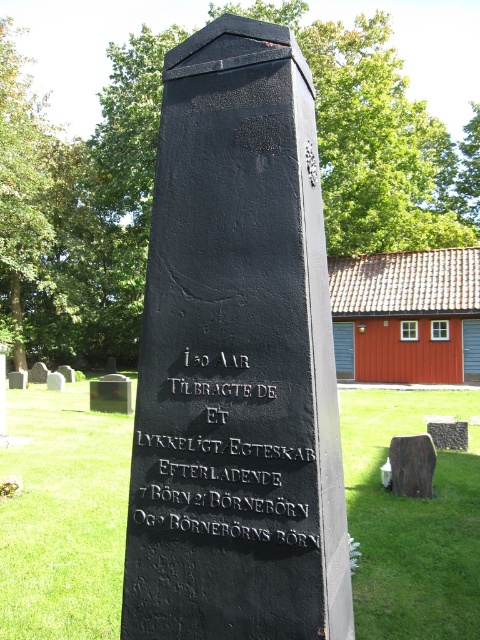
Question: Which point is farther to the camera?

Choices:
 (A) black stone monument at center
 (B) black stone gravestone at center
 (C) black stone plaque at center
 (D) brown wood at center

Answer: (B)

Question: Does black stone plaque at center appear over brown wood at center?

Choices:
 (A) no
 (B) yes

Answer: (B)

Question: Is black stone monument at center further to camera compared to black stone gravestone at center?

Choices:
 (A) no
 (B) yes

Answer: (A)

Question: Which object appears closest to the camera in this image?

Choices:
 (A) black stone monument at center
 (B) brown wood at center

Answer: (A)

Question: Which object is the farthest from the black stone plaque at center?

Choices:
 (A) brown wood at center
 (B) black stone monument at center

Answer: (A)

Question: Can you confirm if black stone plaque at center is wider than brown wood at center?

Choices:
 (A) no
 (B) yes

Answer: (B)